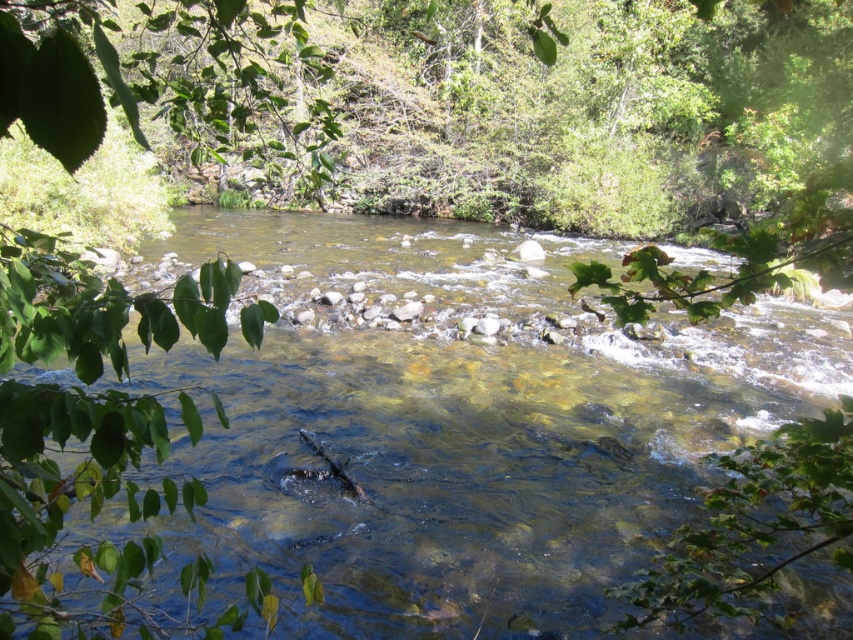
Question: Is clear water at center to the right of green leafy branch at left from the viewer's perspective?

Choices:
 (A) no
 (B) yes

Answer: (A)

Question: Among these objects, which one is farthest from the camera?

Choices:
 (A) green leafy branch at left
 (B) clear water at center

Answer: (A)

Question: In this image, where is clear water at center located relative to green leafy branch at left?

Choices:
 (A) left
 (B) right

Answer: (A)

Question: Is clear water at center closer to the viewer compared to green leafy branch at left?

Choices:
 (A) no
 (B) yes

Answer: (B)

Question: Which point is farther to the camera?

Choices:
 (A) clear water at center
 (B) green leafy branch at left

Answer: (B)